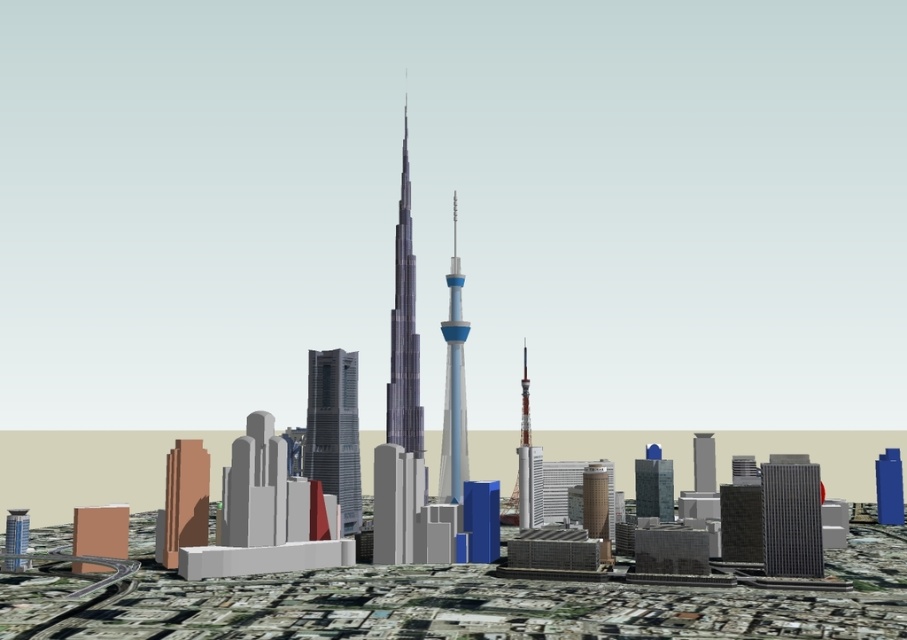
Question: Is blue glass tower at center positioned behind metallic glass skyscraper at center?

Choices:
 (A) no
 (B) yes

Answer: (A)

Question: Is shiny metallic skyscraper at center to the left of smooth gray tower at center from the viewer's perspective?

Choices:
 (A) yes
 (B) no

Answer: (A)

Question: Can you confirm if shiny glass skyscraper at center is positioned below blue glass tower at center?

Choices:
 (A) yes
 (B) no

Answer: (B)

Question: Which point is closer to the camera taking this photo?

Choices:
 (A) (525, 394)
 (B) (820, 500)

Answer: (A)

Question: Which point is farther from the camera taking this photo?

Choices:
 (A) (805, 493)
 (B) (386, 436)

Answer: (A)

Question: Which object is farther from the camera taking this photo?

Choices:
 (A) dark gray glass skyscraper at center right
 (B) blue glass tower at center

Answer: (A)